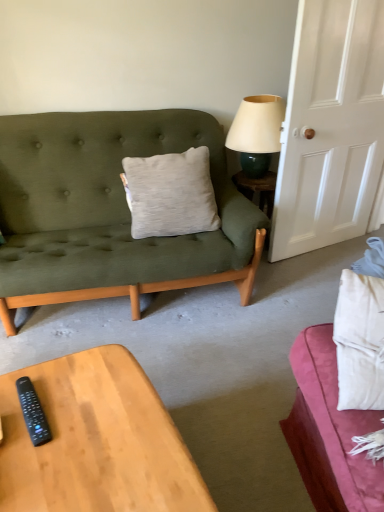
At what (x,y) coordinates should I click in order to perform the action: click on empty space that is to the right of black plastic remote at lower left. Please return your answer as a coordinate pair (x, y). The height and width of the screenshot is (512, 384). Looking at the image, I should click on (97, 411).